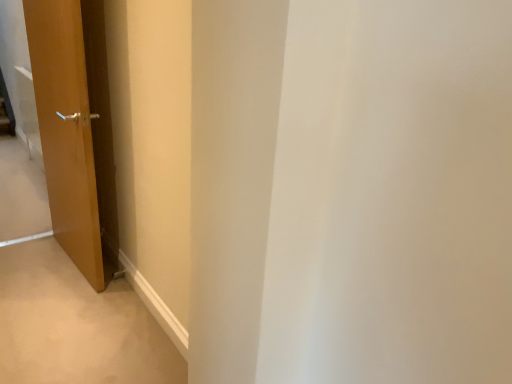
What do you see at coordinates (76, 130) in the screenshot? This screenshot has width=512, height=384. I see `matte wood door at left` at bounding box center [76, 130].

Find the location of a particular element. Image resolution: width=512 pixels, height=384 pixels. matte wood door at left is located at coordinates (76, 130).

What is the approximate width of brown wood door at lower left?

The width of brown wood door at lower left is 5.24 feet.

You are a GUI agent. You are given a task and a screenshot of the screen. Output one action in this format:
    pyautogui.click(x=<x>, y=<y>)
    Task: Click on the brown wood door at lower left
    The image size is (512, 384).
    Given the screenshot: What is the action you would take?
    pyautogui.click(x=75, y=325)

The width and height of the screenshot is (512, 384). Describe the element at coordinates (75, 325) in the screenshot. I see `brown wood door at lower left` at that location.

Find the location of a particular element. This screenshot has height=384, width=512. matte wood door at left is located at coordinates (76, 130).

Visually, is brown wood door at lower left positioned to the left or to the right of matte wood door at left?

In the image, brown wood door at lower left appears on the left side of matte wood door at left.

Which is in front, brown wood door at lower left or matte wood door at left?

brown wood door at lower left is closer to the camera.

Does point (74, 376) come closer to viewer compared to point (64, 87)?

Yes, it is.

From the image's perspective, which object appears higher, brown wood door at lower left or matte wood door at left?

matte wood door at left is shown above in the image.

From a real-world perspective, which is physically above, brown wood door at lower left or matte wood door at left?

matte wood door at left, from a real-world perspective.

In terms of width, does brown wood door at lower left look wider or thinner when compared to matte wood door at left?

Considering their sizes, brown wood door at lower left looks broader than matte wood door at left.

Which of these two, brown wood door at lower left or matte wood door at left, stands shorter?

Standing shorter between the two is brown wood door at lower left.

Considering the sizes of objects brown wood door at lower left and matte wood door at left in the image provided, who is bigger, brown wood door at lower left or matte wood door at left?

matte wood door at left is bigger.

Is brown wood door at lower left positioned beyond the bounds of matte wood door at left?

Yes, brown wood door at lower left is outside of matte wood door at left.

Looking at this image, is there a large distance between brown wood door at lower left and matte wood door at left?

They are positioned close to each other.

Is brown wood door at lower left aimed at matte wood door at left?

No, brown wood door at lower left does not turn towards matte wood door at left.

How many degrees apart are the facing directions of brown wood door at lower left and matte wood door at left?

They differ by 83.3 degrees in their facing directions.

The image size is (512, 384). I want to click on door above the brown wood door at lower left (from a real-world perspective), so click(x=76, y=130).

Considering the relative positions of matte wood door at left and brown wood door at lower left in the image provided, is matte wood door at left to the right of brown wood door at lower left from the viewer's perspective?

Correct, you'll find matte wood door at left to the right of brown wood door at lower left.

Is the depth of matte wood door at left less than that of brown wood door at lower left?

No, matte wood door at left is further to the viewer.

Does point (98, 102) lie in front of point (153, 368)?

That is False.

From the image's perspective, which one is positioned lower, matte wood door at left or brown wood door at lower left?

From the image's view, brown wood door at lower left is below.

From a real-world perspective, who is located lower, matte wood door at left or brown wood door at lower left?

brown wood door at lower left.

Between matte wood door at left and brown wood door at lower left, which one has smaller width?

Thinner between the two is matte wood door at left.

Can you confirm if matte wood door at left is shorter than brown wood door at lower left?

No, matte wood door at left is not shorter than brown wood door at lower left.

Considering the sizes of objects matte wood door at left and brown wood door at lower left in the image provided, who is bigger, matte wood door at left or brown wood door at lower left?

With larger size is matte wood door at left.

Based on the photo, is matte wood door at left not inside brown wood door at lower left?

That's correct, matte wood door at left is outside of brown wood door at lower left.

Is matte wood door at left next to brown wood door at lower left and touching it?

No, matte wood door at left is not touching brown wood door at lower left.

Is matte wood door at left looking in the opposite direction of brown wood door at lower left?

No, matte wood door at left is not facing the opposite direction of brown wood door at lower left.

Looking at this image, what's the angular difference between matte wood door at left and brown wood door at lower left's facing directions?

There is a 83.3-degree angle between the facing directions of matte wood door at left and brown wood door at lower left.

This screenshot has height=384, width=512. What are the coordinates of `door behind the brown wood door at lower left` in the screenshot? It's located at click(76, 130).

The width and height of the screenshot is (512, 384). I want to click on path lying below the matte wood door at left (from the image's perspective), so click(x=75, y=325).

Locate an element on the screen. The height and width of the screenshot is (384, 512). path that appears on the left of matte wood door at left is located at coordinates (75, 325).